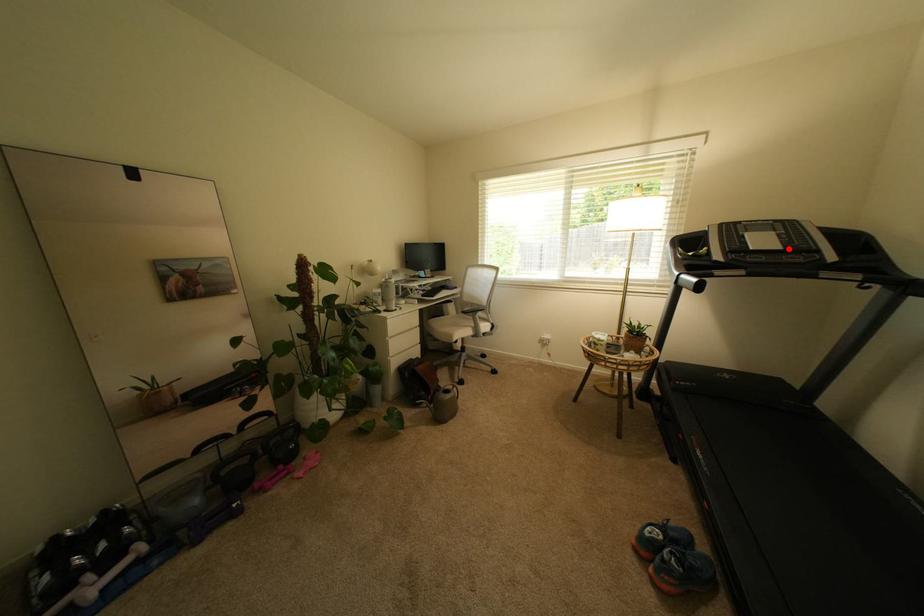
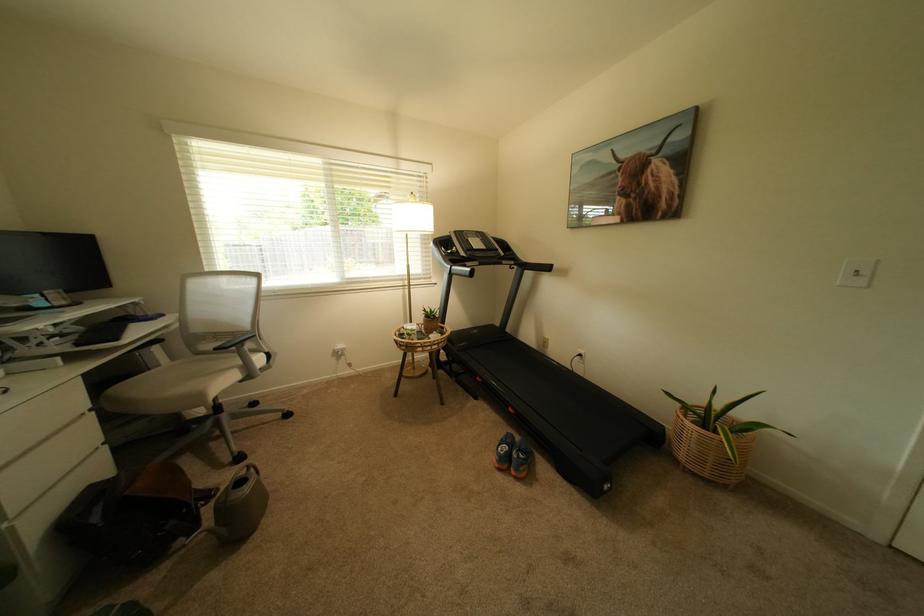
The point at the highlighted location is marked in the first image. Where is the corresponding point in the second image?

(493, 249)